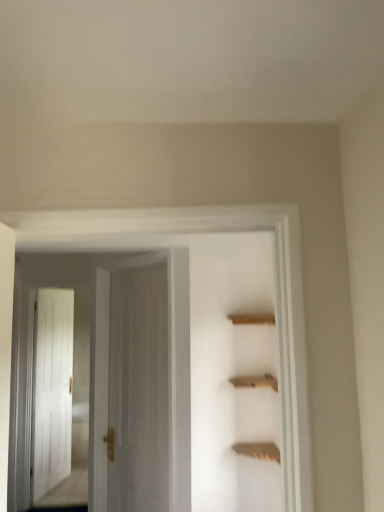
Identify the location of wooden shelf at upper center. Image resolution: width=384 pixels, height=512 pixels. (258, 450).

Measure the distance between point (90, 399) and camera.

The distance of point (90, 399) from camera is 2.61 meters.

The width and height of the screenshot is (384, 512). Find the location of `wooden shelf at upper center`. wooden shelf at upper center is located at coordinates (258, 450).

At what (x,y) coordinates should I click in order to perform the action: click on cabinet above the white glossy door at center, positioned as the first door in back-to-front order (from the image's perspective). Please return your answer as a coordinate pair (x, y). Looking at the image, I should click on (258, 450).

Who is bigger, white glossy door at center, positioned as the first door in back-to-front order, or wooden shelf at upper center?

With larger size is white glossy door at center, positioned as the first door in back-to-front order.

Between point (162, 429) and point (246, 445), which one is positioned behind?

The point (162, 429) is behind.

Are white glossy door at center, acting as the 2th door starting from the front, and wooden shelf at upper center located far from each other?

No, white glossy door at center, acting as the 2th door starting from the front, is not far from wooden shelf at upper center.

Which object is closer to the camera, wooden shelf at upper center or white glossy door at center, positioned as the first door in back-to-front order?

wooden shelf at upper center is in front.

Is point (268, 454) closer or farther from the camera than point (117, 460)?

Point (268, 454) is positioned closer to the camera compared to point (117, 460).

Is wooden shelf at upper center smaller than white glossy door at center, acting as the 2th door starting from the front?

Correct, wooden shelf at upper center occupies less space than white glossy door at center, acting as the 2th door starting from the front.

At what (x,y) coordinates should I click in order to perform the action: click on cabinet in front of the white glossy door at center, acting as the 2th door starting from the front. Please return your answer as a coordinate pair (x, y). The image size is (384, 512). Looking at the image, I should click on (258, 450).

In the scene shown: Considering the relative sizes of white wooden door at center, the second door positioned from the back, and wooden shelf at upper center in the image provided, is white wooden door at center, the second door positioned from the back, taller than wooden shelf at upper center?

Yes.

Is white wooden door at center, placed as the 1th door when sorted from front to back, next to wooden shelf at upper center?

white wooden door at center, placed as the 1th door when sorted from front to back, and wooden shelf at upper center are clearly separated.

Locate an element on the screen. cabinet on the right of white wooden door at center, placed as the 1th door when sorted from front to back is located at coordinates (258, 450).

Between white wooden door at center, the second door positioned from the back, and wooden shelf at upper center, which one has smaller width?

Thinner between the two is white wooden door at center, the second door positioned from the back.

Is wooden shelf at upper center positioned beyond the bounds of white wooden door at center, the second door positioned from the back?

wooden shelf at upper center lies outside white wooden door at center, the second door positioned from the back,'s area.

Is wooden shelf at upper center aimed at white wooden door at center, placed as the 1th door when sorted from front to back?

No, wooden shelf at upper center is not aimed at white wooden door at center, placed as the 1th door when sorted from front to back.

Considering the sizes of objects wooden shelf at upper center and white wooden door at center, the second door positioned from the back, in the image provided, who is smaller, wooden shelf at upper center or white wooden door at center, the second door positioned from the back,?

With smaller size is wooden shelf at upper center.

From a real-world perspective, is white glossy door at center, acting as the 2th door starting from the front, physically above white wooden door at center, placed as the 1th door when sorted from front to back?

No, from a real-world perspective, white glossy door at center, acting as the 2th door starting from the front, is not above white wooden door at center, placed as the 1th door when sorted from front to back.

Considering the relative positions of white glossy door at center, positioned as the first door in back-to-front order, and white wooden door at center, placed as the 1th door when sorted from front to back, in the image provided, is white glossy door at center, positioned as the first door in back-to-front order, to the left or to the right of white wooden door at center, placed as the 1th door when sorted from front to back,?

From the image, it's evident that white glossy door at center, positioned as the first door in back-to-front order, is to the left of white wooden door at center, placed as the 1th door when sorted from front to back.

Does point (147, 278) lie in front of point (180, 416)?

No.

Measure the distance from white glossy door at center, positioned as the first door in back-to-front order, to white wooden door at center, placed as the 1th door when sorted from front to back.

white glossy door at center, positioned as the first door in back-to-front order, is 6.29 inches from white wooden door at center, placed as the 1th door when sorted from front to back.

Between white wooden door at center, the second door positioned from the back, and white glossy door at center, positioned as the first door in back-to-front order, which one has larger size?

white wooden door at center, the second door positioned from the back, is bigger.

From the image's perspective, is white wooden door at center, the second door positioned from the back, above or below white glossy door at center, positioned as the first door in back-to-front order?

white wooden door at center, the second door positioned from the back, is situated higher than white glossy door at center, positioned as the first door in back-to-front order, in the image.

Would you say white wooden door at center, placed as the 1th door when sorted from front to back, is inside or outside white glossy door at center, acting as the 2th door starting from the front?

white wooden door at center, placed as the 1th door when sorted from front to back, lies outside white glossy door at center, acting as the 2th door starting from the front.

Looking at this image, which of these two, white wooden door at center, placed as the 1th door when sorted from front to back, or white glossy door at center, acting as the 2th door starting from the front, is thinner?

With smaller width is white glossy door at center, acting as the 2th door starting from the front.

Where is `cabinet that appears on the right of white glossy door at center, acting as the 2th door starting from the front`? cabinet that appears on the right of white glossy door at center, acting as the 2th door starting from the front is located at coordinates pos(258,450).

This screenshot has height=512, width=384. In order to click on cabinet lying above the white glossy door at center, acting as the 2th door starting from the front (from the image's perspective) in this screenshot , I will do `click(258, 450)`.

Looking at the image, which one is located further to white wooden door at center, placed as the 1th door when sorted from front to back, white glossy door at center, acting as the 2th door starting from the front, or wooden shelf at upper center?

wooden shelf at upper center.

Estimate the real-world distances between objects in this image. Which object is closer to white glossy door at center, acting as the 2th door starting from the front, white wooden door at center, the second door positioned from the back, or wooden shelf at upper center?

white wooden door at center, the second door positioned from the back, lies closer to white glossy door at center, acting as the 2th door starting from the front, than the other object.

When comparing their distances from wooden shelf at upper center, does white glossy door at center, acting as the 2th door starting from the front, or white wooden door at center, the second door positioned from the back, seem further?

Based on the image, white glossy door at center, acting as the 2th door starting from the front, appears to be further to wooden shelf at upper center.

Considering their positions, is white wooden door at center, placed as the 1th door when sorted from front to back, positioned closer to wooden shelf at upper center than white glossy door at center, positioned as the first door in back-to-front order?

Among the two, white wooden door at center, placed as the 1th door when sorted from front to back, is located nearer to wooden shelf at upper center.

Estimate the real-world distances between objects in this image. Which object is closer to white glossy door at center, positioned as the first door in back-to-front order, wooden shelf at upper center or white wooden door at center, the second door positioned from the back?

white wooden door at center, the second door positioned from the back.

Looking at the image, which one is located closer to white wooden door at center, placed as the 1th door when sorted from front to back, wooden shelf at upper center or white glossy door at center, acting as the 2th door starting from the front?

white glossy door at center, acting as the 2th door starting from the front, lies closer to white wooden door at center, placed as the 1th door when sorted from front to back, than the other object.

At what (x,y) coordinates should I click in order to perform the action: click on cabinet located between white wooden door at center, the second door positioned from the back, and white glossy door at center, acting as the 2th door starting from the front, in the depth direction. Please return your answer as a coordinate pair (x, y). This screenshot has height=512, width=384. Looking at the image, I should click on (258, 450).